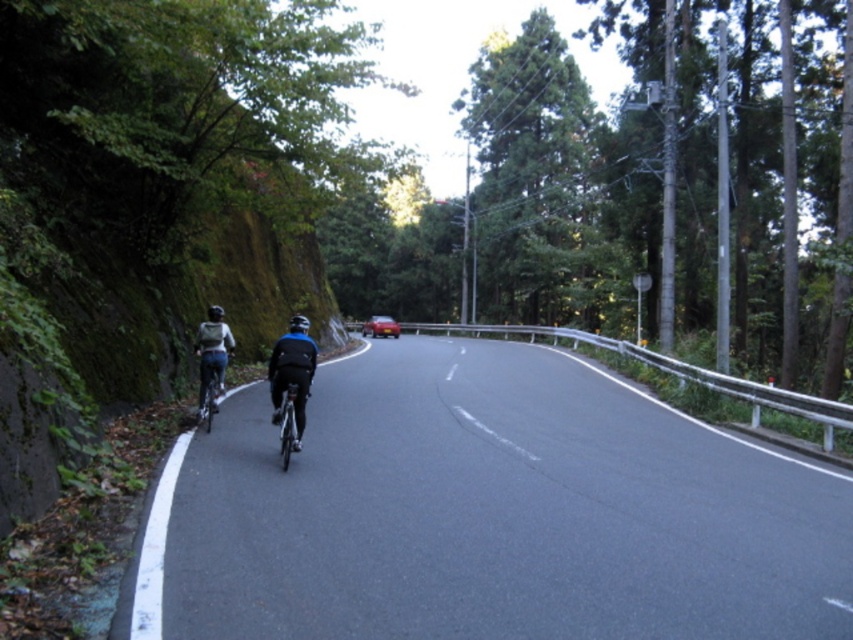
Question: Observing the image, what is the correct spatial positioning of shiny metallic bicycle at left in reference to shiny red car at center?

Choices:
 (A) above
 (B) below

Answer: (B)

Question: Which object is the farthest from the black asphalt road at center?

Choices:
 (A) shiny metallic bicycle at left
 (B) shiny red car at center
 (C) black matte bicycle helmet at upper center
 (D) shiny metallic bicycle at center

Answer: (B)

Question: Does shiny metallic bicycle at center appear over shiny black helmet at upper center?

Choices:
 (A) yes
 (B) no

Answer: (B)

Question: Which object is the closest to the black asphalt road at center?

Choices:
 (A) shiny metallic bicycle at left
 (B) blue fabric jacket at center

Answer: (A)

Question: Can you confirm if shiny metallic bicycle at left is positioned to the right of shiny metallic bicycle at center?

Choices:
 (A) no
 (B) yes

Answer: (A)

Question: Which point is farther to the camera?

Choices:
 (A) black asphalt road at center
 (B) blue fabric jacket at center
 (C) shiny black helmet at upper center

Answer: (C)